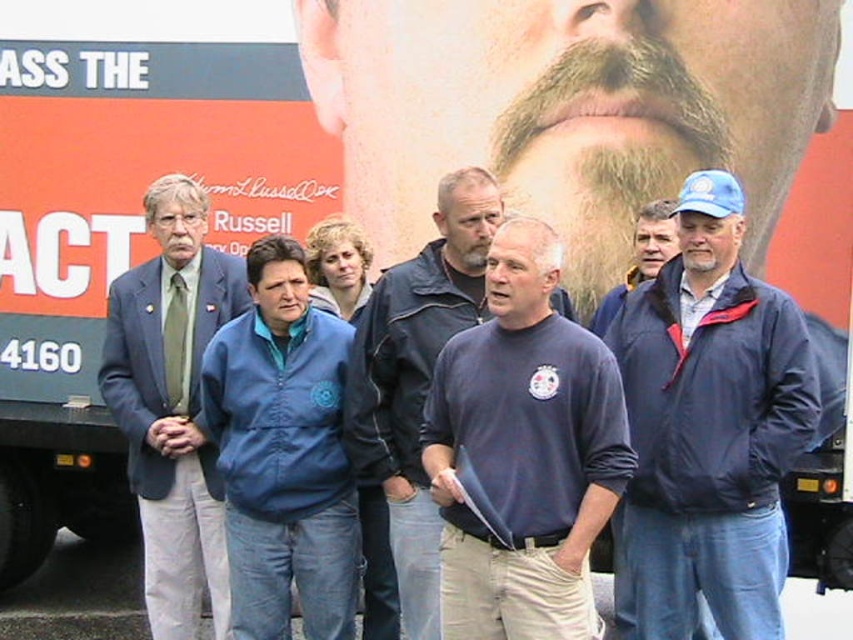
Question: Does blue fabric jacket at left appear under brown fuzzy beard at center?

Choices:
 (A) no
 (B) yes

Answer: (B)

Question: Does blue fabric jacket at center have a larger size compared to brown fuzzy beard at center?

Choices:
 (A) yes
 (B) no

Answer: (A)

Question: Based on their relative distances, which object is farther from the brown fuzzy beard at center?

Choices:
 (A) beardsoft hair at center
 (B) dark blue sweatshirt at center

Answer: (B)

Question: Among these objects, which one is farthest from the camera?

Choices:
 (A) blue jacket at center
 (B) brown fuzzy beard at center

Answer: (A)

Question: Which object appears farthest from the camera in this image?

Choices:
 (A) blue nylon jacket at center
 (B) brown fuzzy beard at center
 (C) blue fabric jacket at center

Answer: (B)

Question: Is beardsoft hair at center thinner than blue nylon jacket at center?

Choices:
 (A) no
 (B) yes

Answer: (A)